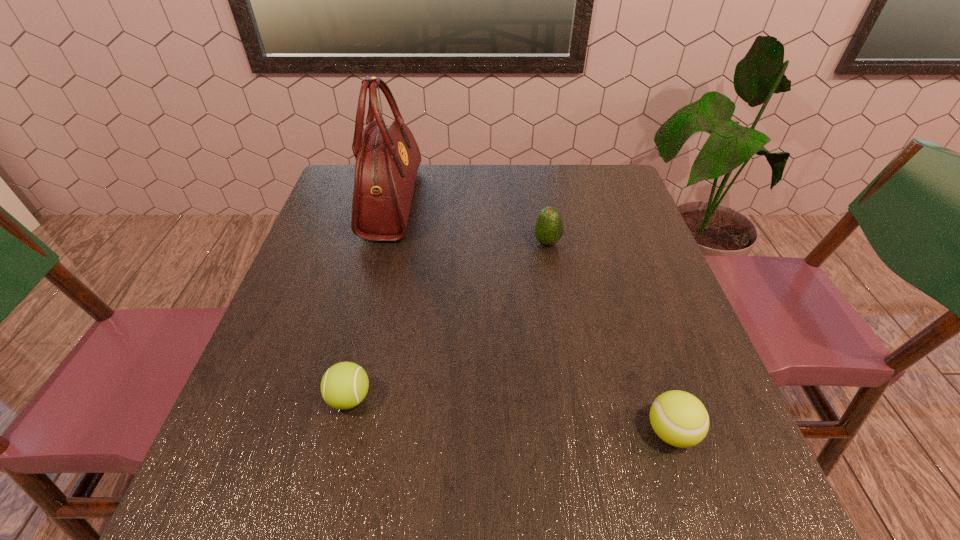
Find the location of a particular element. This screenshot has height=540, width=960. object that ranks as the second closest to the left tennis ball is located at coordinates (680, 419).

Where is `free point that satisfies the following two spatial constraints: 1. on the front-facing side of the second tallest object; 2. on the left side of the tallest object`? Image resolution: width=960 pixels, height=540 pixels. free point that satisfies the following two spatial constraints: 1. on the front-facing side of the second tallest object; 2. on the left side of the tallest object is located at coordinates pyautogui.click(x=382, y=242).

Find the location of a particular element. The width and height of the screenshot is (960, 540). free space that satisfies the following two spatial constraints: 1. on the front-facing side of the rightmost object; 2. on the left side of the tallest object is located at coordinates (335, 431).

Where is `vacant region that satisfies the following two spatial constraints: 1. on the front side of the left tennis ball; 2. on the right side of the rightmost object`? vacant region that satisfies the following two spatial constraints: 1. on the front side of the left tennis ball; 2. on the right side of the rightmost object is located at coordinates (342, 431).

Identify the location of free space that satisfies the following two spatial constraints: 1. on the front-facing side of the handbag; 2. on the back side of the third shortest object. (382, 242).

Locate an element on the screen. The height and width of the screenshot is (540, 960). vacant region that satisfies the following two spatial constraints: 1. on the front-facing side of the tallest object; 2. on the right side of the rightmost object is located at coordinates (335, 431).

I want to click on vacant space that satisfies the following two spatial constraints: 1. on the front-facing side of the handbag; 2. on the back side of the right tennis ball, so click(335, 431).

The image size is (960, 540). In order to click on free spot that satisfies the following two spatial constraints: 1. on the front-facing side of the avocado; 2. on the left side of the tallest object in this screenshot , I will do `click(382, 242)`.

This screenshot has height=540, width=960. I want to click on vacant area in the image that satisfies the following two spatial constraints: 1. on the front-facing side of the avocado; 2. on the right side of the handbag, so click(x=382, y=242).